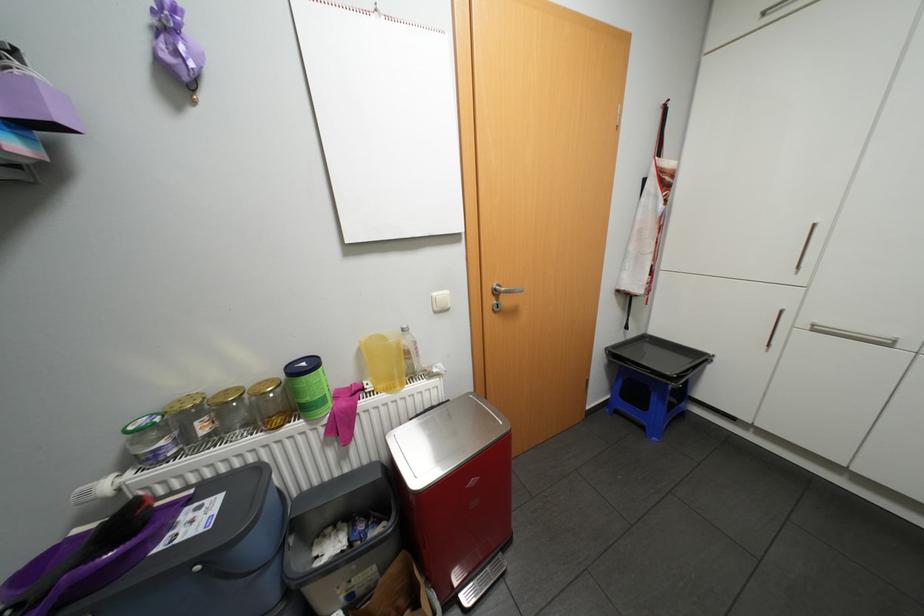
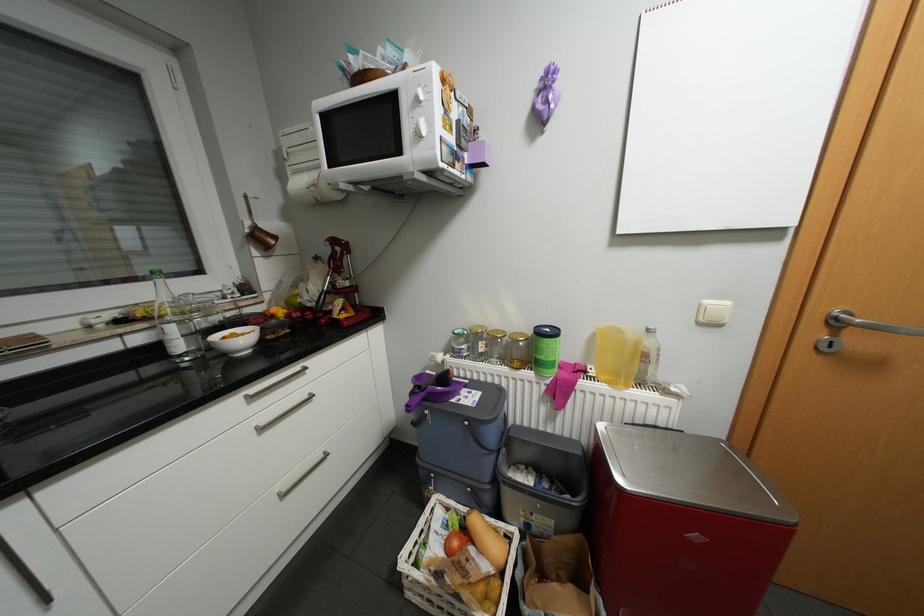
In the second image, find the point that corresponds to (203,422) in the first image.

(488, 342)